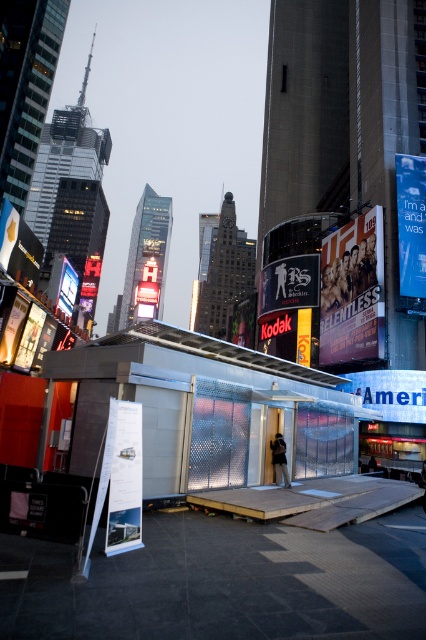
Question: Among these objects, which one is nearest to the camera?

Choices:
 (A) white paper at lower left
 (B) blue fabric billboard at upper right
 (C) matte kodak sign at center

Answer: (A)

Question: Is shiny black sign at center bigger than matte black monitor at upper left?

Choices:
 (A) yes
 (B) no

Answer: (A)

Question: Is matte kodak sign at center to the right of matte black monitor at upper left from the viewer's perspective?

Choices:
 (A) yes
 (B) no

Answer: (A)

Question: Is blue fabric billboard at center above matte black monitor at upper left?

Choices:
 (A) no
 (B) yes

Answer: (A)

Question: Which point is farther to the camera?

Choices:
 (A) purple glossy poster at center
 (B) shiny black sign at center

Answer: (B)

Question: Among these objects, which one is nearest to the camera?

Choices:
 (A) matte kodak sign at center
 (B) matte black monitor at upper left

Answer: (A)